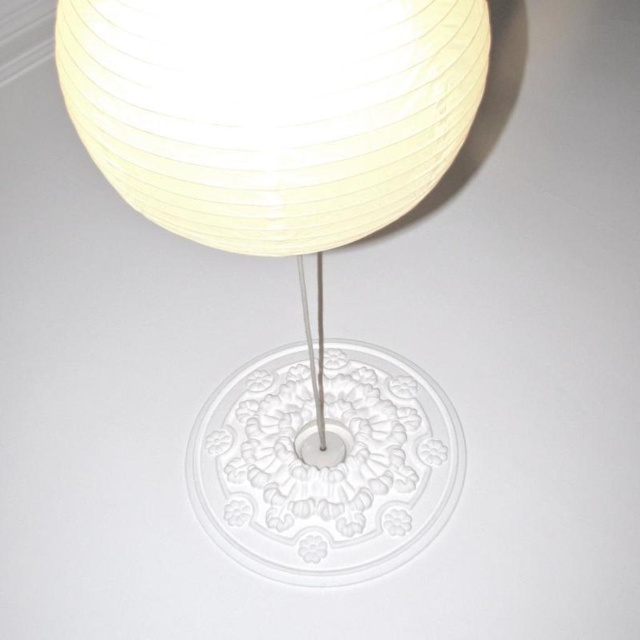
Question: Which point is farther to the camera?

Choices:
 (A) (262, 81)
 (B) (337, 196)

Answer: (B)

Question: Considering the relative positions of white paper lampshade at center and white paper lampshade at upper center in the image provided, where is white paper lampshade at center located with respect to white paper lampshade at upper center?

Choices:
 (A) right
 (B) left

Answer: (A)

Question: Is white paper lampshade at center above white paper lampshade at upper center?

Choices:
 (A) no
 (B) yes

Answer: (A)

Question: Which point is closer to the camera taking this photo?

Choices:
 (A) (272, 221)
 (B) (97, 8)

Answer: (B)

Question: Which point is closer to the camera taking this photo?

Choices:
 (A) (113, 93)
 (B) (404, 182)

Answer: (A)

Question: From the image, what is the correct spatial relationship of white paper lampshade at center in relation to white paper lampshade at upper center?

Choices:
 (A) below
 (B) above

Answer: (A)